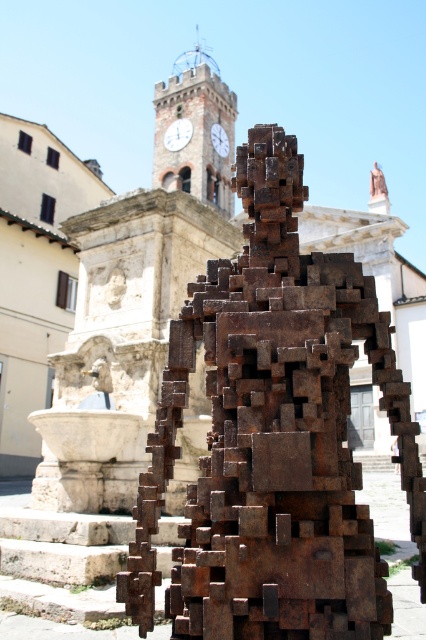
You are an art student analyzing the spatial relationships in the image. You notice the white clock face at upper center and the rustic metal clock at center. Which object appears taller in the scene?

The white clock face at upper center is taller than the rustic metal clock at center.

You are standing at the entrance of the historic stone building and want to take a photo of the rusty metal sculpture at center. Which direction should you face to ensure the sculpture is in the frame?

The rusty metal sculpture at center is located at point coordinates, so you should face towards the center of the image to capture it in your photo.

Consider the image. You are standing in front of the sculpture and want to take a photo of the rustic stone clock tower at upper center. Based on your current position, what are the coordinates of the clock tower in the image?

The coordinates of the rustic stone clock tower at upper center are at point (193, 129).